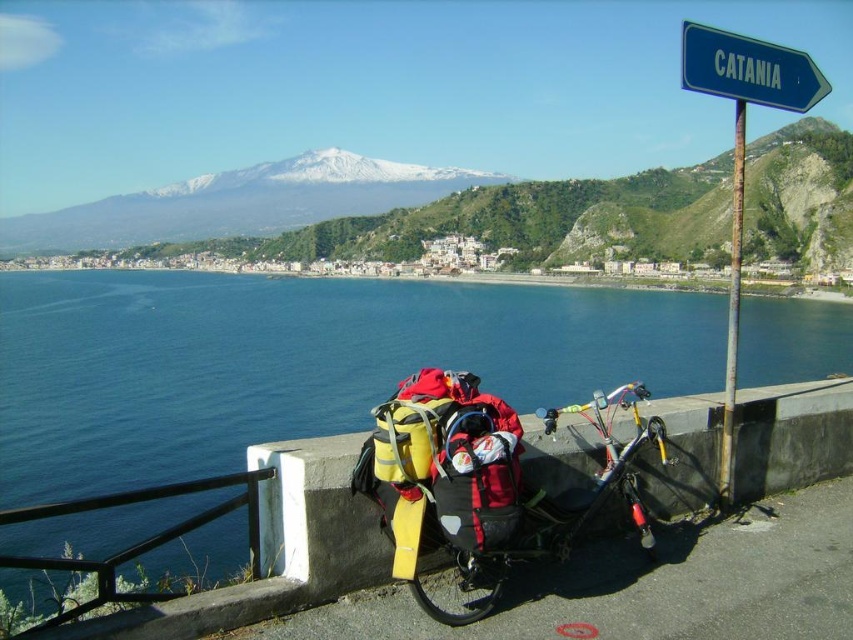
Question: Can you confirm if blue metal signpost at upper right is thinner than blue plastic signpost at upper right?

Choices:
 (A) no
 (B) yes

Answer: (A)

Question: In this image, where is blue metal signpost at upper right located relative to blue plastic signpost at upper right?

Choices:
 (A) above
 (B) below

Answer: (B)

Question: Estimate the real-world distances between objects in this image. Which object is closer to the blue metal signpost at upper right?

Choices:
 (A) black metal/rail at lower left
 (B) yellow fabric bicycle at lower center

Answer: (B)

Question: Which of the following is the closest to the observer?

Choices:
 (A) yellow fabric bicycle at lower center
 (B) blue metal signpost at upper right

Answer: (A)

Question: Which is nearer to the yellow fabric bicycle at lower center?

Choices:
 (A) blue water at lower left
 (B) blue metal signpost at upper right
 (C) rusty metal pole at right
 (D) blue plastic signpost at upper right

Answer: (C)

Question: Is yellow fabric bicycle at lower center smaller than blue metal signpost at upper right?

Choices:
 (A) yes
 (B) no

Answer: (A)